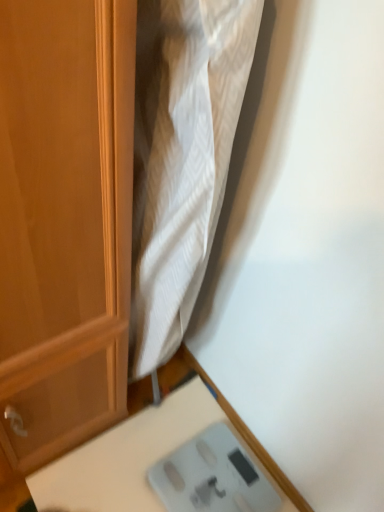
This screenshot has width=384, height=512. I want to click on free spot above gray plastic scale at lower right (from a real-world perspective), so click(x=220, y=478).